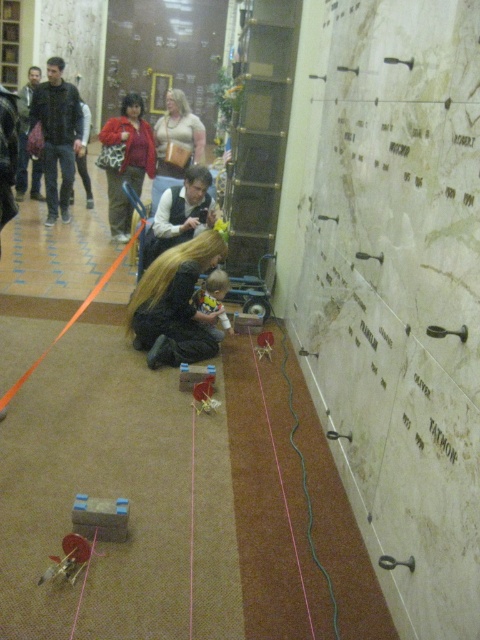
You are standing in the mausoleum and notice a point marked at coordinates [126,161]. What object is located at that point?

The point at coordinates [126,161] indicates a matte red jacket at center.

You are a visitor in the mausoleum and want to locate the matte red jacket at center. Where should you look in relation to the wooden plaque at upper center?

The matte red jacket at center is on the right side of the wooden plaque at upper center.